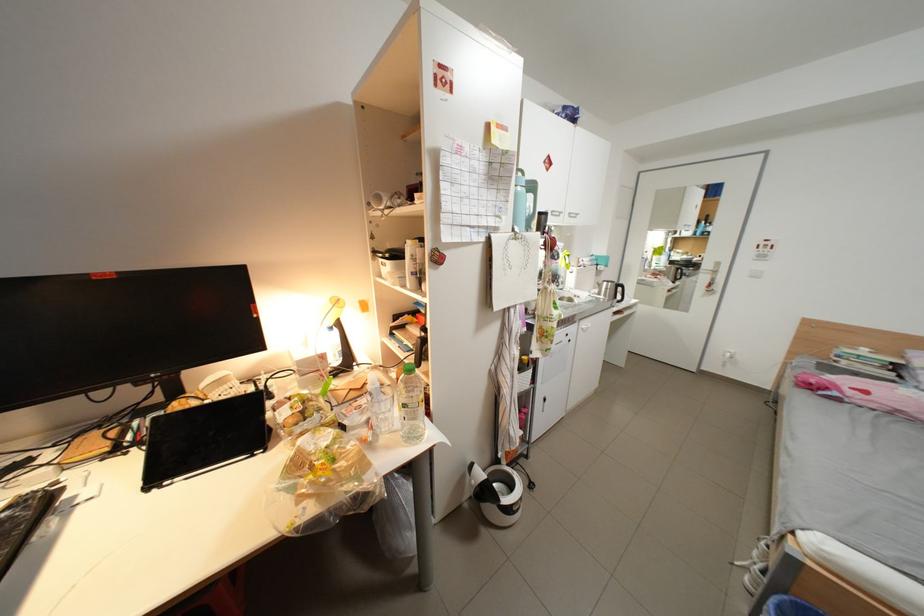
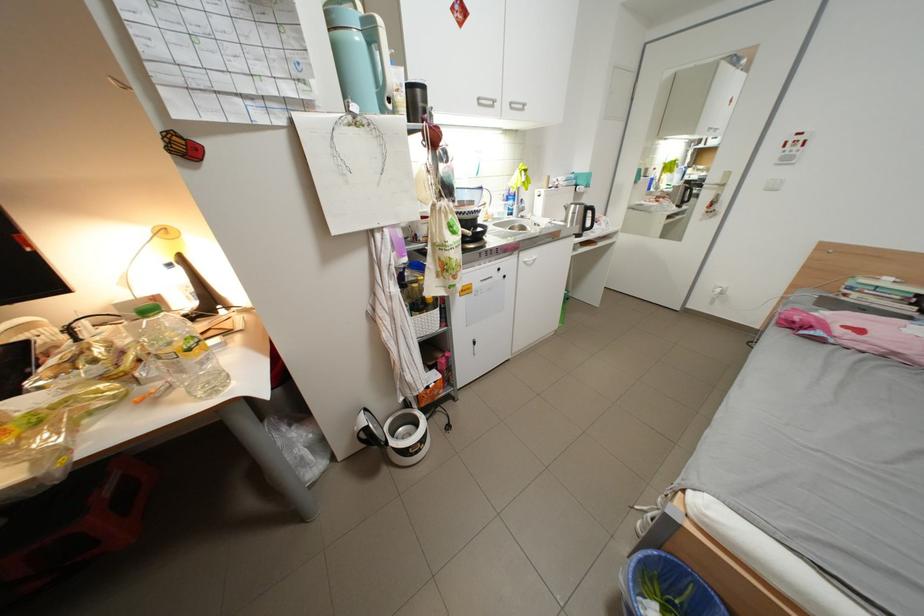
In the second image, find the point that corresponds to (x=618, y=290) in the first image.

(585, 215)